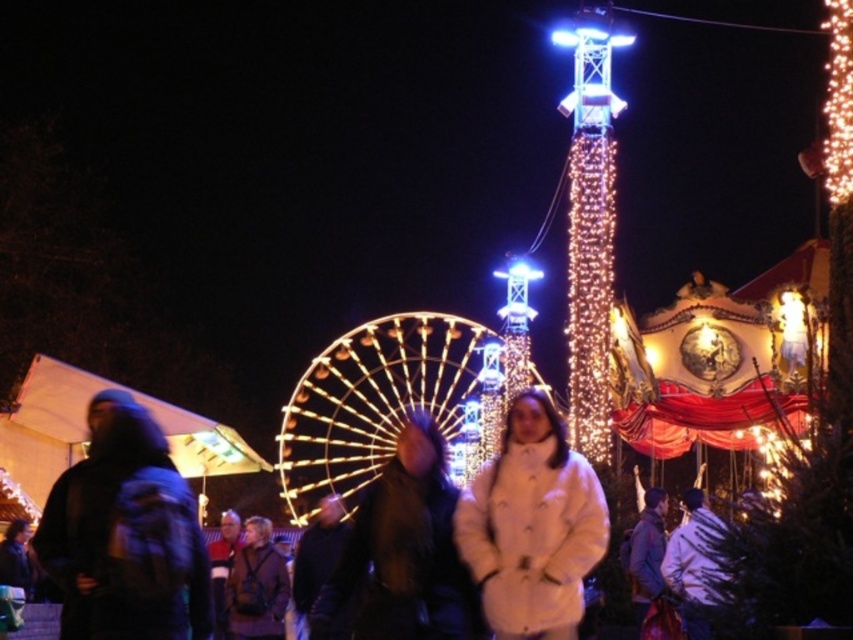
Question: Which point appears farthest from the camera in this image?

Choices:
 (A) (827, 116)
 (B) (583, 221)
 (C) (535, 534)

Answer: (A)

Question: Does white fluffy coat at center have a smaller size compared to illuminated string lights at upper right?

Choices:
 (A) no
 (B) yes

Answer: (B)

Question: Which point is farther to the camera?

Choices:
 (A) (834, 33)
 (B) (509, 540)
 (C) (592, 440)

Answer: (C)

Question: Observing the image, what is the correct spatial positioning of illuminated wireframe structure at upper center in reference to illuminated string lights at upper right?

Choices:
 (A) left
 (B) right

Answer: (A)

Question: Is illuminated wireframe structure at upper center bigger than illuminated string lights at upper right?

Choices:
 (A) yes
 (B) no

Answer: (B)

Question: Among these objects, which one is nearest to the camera?

Choices:
 (A) illuminated string lights at upper right
 (B) illuminated wireframe structure at upper center
 (C) white fluffy coat at center

Answer: (C)